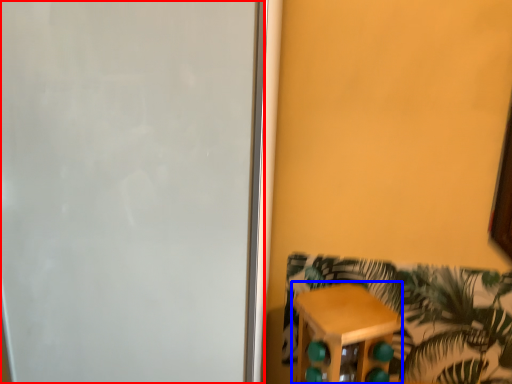
Question: Which object appears farthest to the camera in this image, screen door (highlighted by a red box) or furniture (highlighted by a blue box)?

Choices:
 (A) screen door
 (B) furniture

Answer: (B)